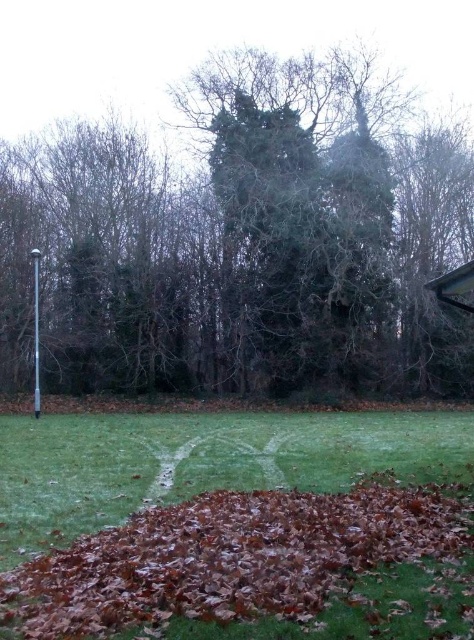
Is green leafy tree at center above brown leaf litter at lower center?

Yes.

Who is positioned more to the right, green leafy tree at center or brown leaf litter at lower center?

From the viewer's perspective, green leafy tree at center appears more on the right side.

Between point (222, 365) and point (29, 547), which one is positioned in front?

Point (29, 547) is in front.

Image resolution: width=474 pixels, height=640 pixels. What are the coordinates of `green leafy tree at center` in the screenshot? It's located at (243, 241).